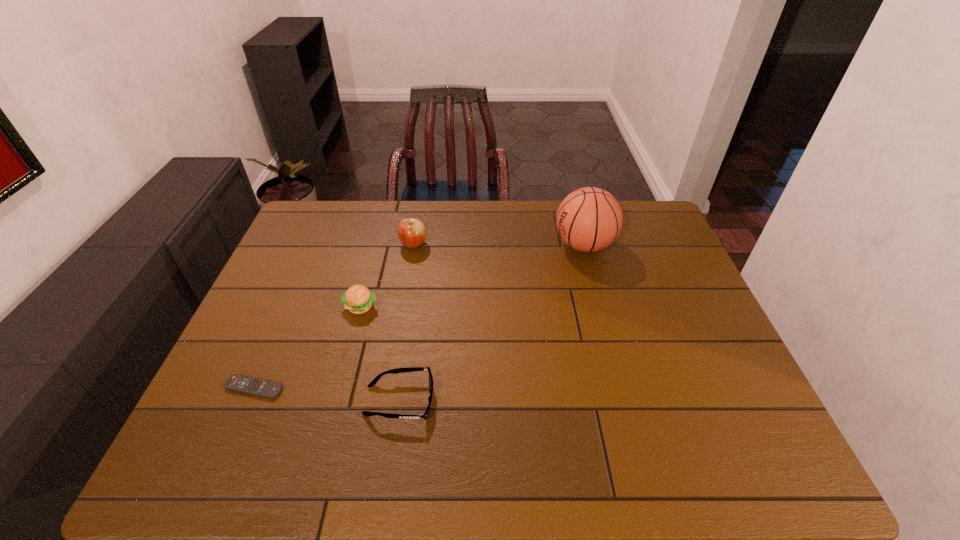
In order to click on free spot located 0.180m on the surface of the tallest object near the brand logo in this screenshot , I will do `click(498, 245)`.

The image size is (960, 540). Find the location of `vacant space positioned 0.350m on the right of the apple`. vacant space positioned 0.350m on the right of the apple is located at coordinates (535, 245).

Find the location of a particular element. This screenshot has height=540, width=960. free location located 0.280m on the right of the third shortest object is located at coordinates (477, 307).

The width and height of the screenshot is (960, 540). I want to click on vacant space located on the front-facing side of the second shortest object, so click(x=571, y=401).

You are a GUI agent. You are given a task and a screenshot of the screen. Output one action in this format:
    pyautogui.click(x=<x>, y=<y>)
    Task: Click on the vacant space located 0.240m on the back of the leftmost object
    This screenshot has height=540, width=960.
    Given the screenshot: What is the action you would take?
    pyautogui.click(x=290, y=305)

I want to click on basketball that is at the far edge, so click(x=589, y=219).

Identify the location of apple at the far edge. Image resolution: width=960 pixels, height=540 pixels. (412, 233).

This screenshot has height=540, width=960. I want to click on object situated at the left edge, so click(x=238, y=383).

Find the location of `free spot at the far edge of the desktop`. free spot at the far edge of the desktop is located at coordinates (480, 241).

In the image, there is a desktop. Where is `vacant space at the near edge`? The width and height of the screenshot is (960, 540). vacant space at the near edge is located at coordinates (588, 447).